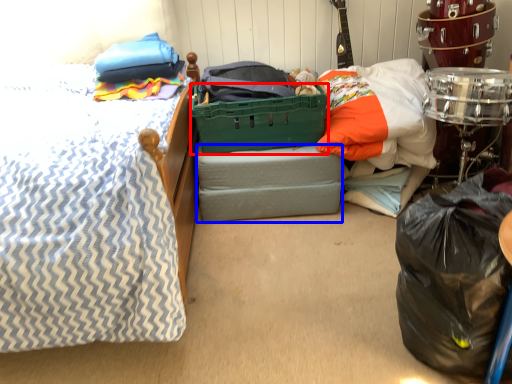
Question: Which of the following is the closest to the observer, basket (highlighted by a red box) or storage box (highlighted by a blue box)?

Choices:
 (A) basket
 (B) storage box

Answer: (A)